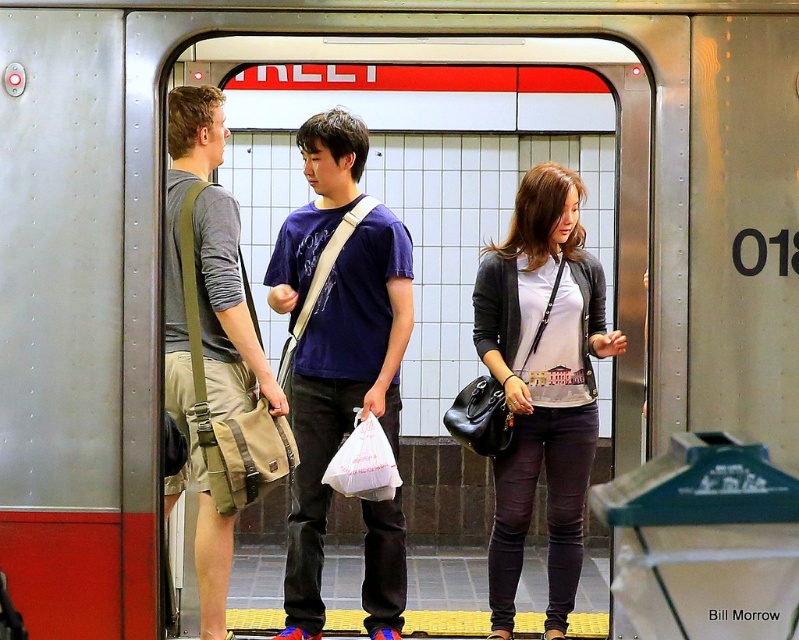
Is matte blue t-shirt at center to the left of khaki shorts at left from the viewer's perspective?

Incorrect, matte blue t-shirt at center is not on the left side of khaki shorts at left.

Where is `matte blue t-shirt at center`? This screenshot has width=799, height=640. matte blue t-shirt at center is located at coordinates (342, 390).

Which is more to the right, matte black purse at center or khaki shorts at left?

From the viewer's perspective, matte black purse at center appears more on the right side.

Can you confirm if matte black purse at center is positioned below khaki shorts at left?

Yes, matte black purse at center is below khaki shorts at left.

Is point (577, 244) closer to camera compared to point (193, 124)?

No, (577, 244) is further to viewer.

Identify the location of matte black purse at center. pos(543,385).

Is matte blue t-shirt at center above matte black purse at center?

Yes, matte blue t-shirt at center is above matte black purse at center.

Does matte blue t-shirt at center have a greater width compared to matte black purse at center?

Yes.

Between point (277, 259) and point (570, 552), which one is positioned behind?

The point (570, 552) is more distant.

Identify the location of matte blue t-shirt at center. The width and height of the screenshot is (799, 640). (342, 390).